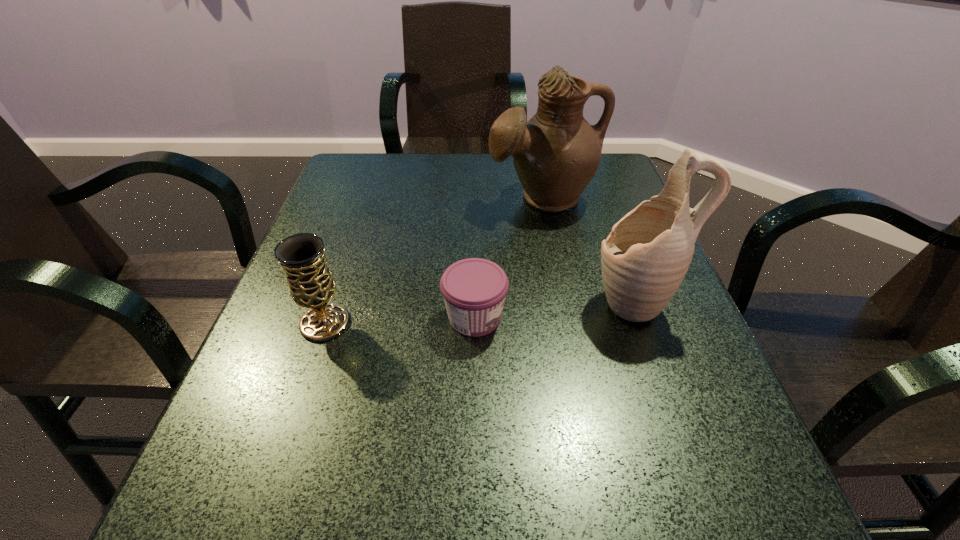
You are a GUI agent. You are given a task and a screenshot of the screen. Output one action in this format:
    pyautogui.click(x=<x>, y=<y>)
    Task: Click on the free space that satisfies the following two spatial constraints: 1. at the spout of the farthest object; 2. on the front label of the shortest object
    
    Given the screenshot: What is the action you would take?
    pyautogui.click(x=565, y=317)